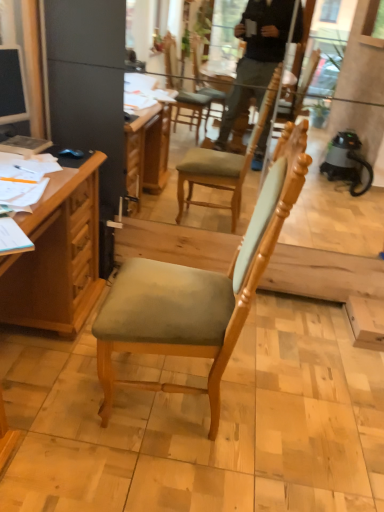
Where is `vacant space situated on the left part of blue matte computer mouse at upper left`? This screenshot has width=384, height=512. vacant space situated on the left part of blue matte computer mouse at upper left is located at coordinates (43, 155).